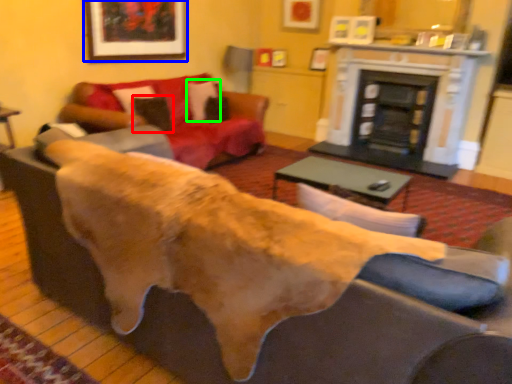
Question: Estimate the real-world distances between objects in this image. Which object is closer to pillow (highlighted by a red box), picture frame (highlighted by a blue box) or pillow (highlighted by a green box)?

Choices:
 (A) picture frame
 (B) pillow

Answer: (B)